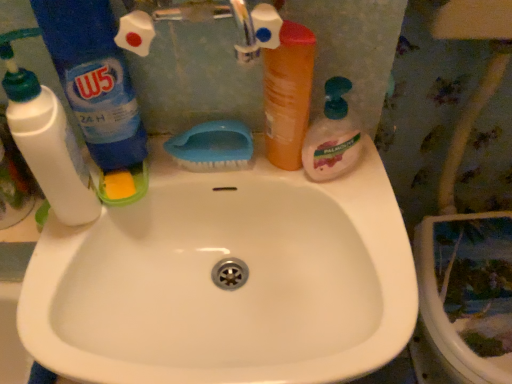
Identify the location of vacant space in front of white plastic bottle at left, which is the first cleaning product from left to right. (61, 287).